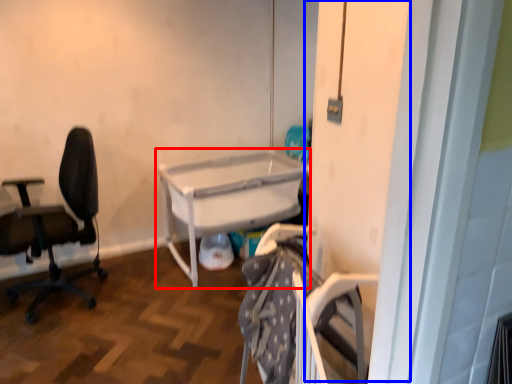
Question: Which of the following is the closest to the observer, table (highlighted by a red box) or screen door (highlighted by a blue box)?

Choices:
 (A) table
 (B) screen door

Answer: (B)